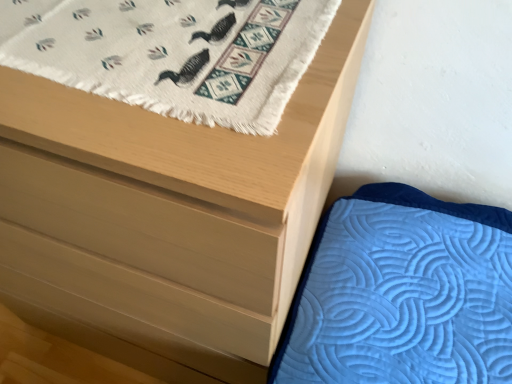
Question: From the image's perspective, is white woven rug with duck pattern at upper left above or below matte wood chest of drawers at upper left?

Choices:
 (A) above
 (B) below

Answer: (A)

Question: Relative to matte wood chest of drawers at upper left, is white woven rug with duck pattern at upper left in front or behind?

Choices:
 (A) behind
 (B) front

Answer: (A)

Question: Do you think white woven rug with duck pattern at upper left is within matte wood chest of drawers at upper left, or outside of it?

Choices:
 (A) outside
 (B) inside

Answer: (B)

Question: Relative to white woven rug with duck pattern at upper left, is matte wood chest of drawers at upper left in front or behind?

Choices:
 (A) front
 (B) behind

Answer: (A)

Question: Is matte wood chest of drawers at upper left inside or outside of white woven rug with duck pattern at upper left?

Choices:
 (A) outside
 (B) inside

Answer: (A)

Question: Visually, is matte wood chest of drawers at upper left positioned to the left or to the right of white woven rug with duck pattern at upper left?

Choices:
 (A) left
 (B) right

Answer: (A)

Question: Is point (0, 178) positioned closer to the camera than point (188, 13)?

Choices:
 (A) farther
 (B) closer

Answer: (B)